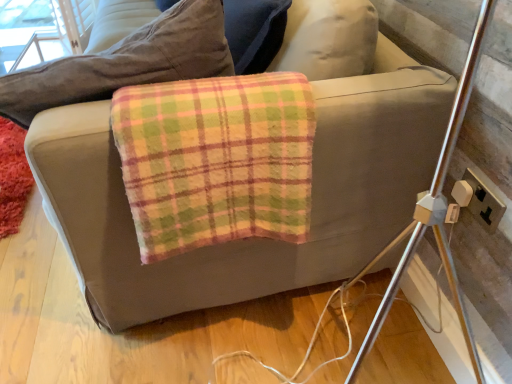
What is the approximate height of gold plastic electrical outlet at right?

It is 9.48 centimeters.

Describe the element at coordinates (13, 177) in the screenshot. I see `fluffy red mat at lower left` at that location.

What is the approximate width of plaid fleece blanket at center?

It is 10.97 inches.

Where is `gold plastic electrical outlet at right`? This screenshot has height=384, width=512. gold plastic electrical outlet at right is located at coordinates (484, 203).

Based on the photo, in terms of height, does plaid fleece blanket at center look taller or shorter compared to gold plastic electrical outlet at right?

In the image, plaid fleece blanket at center appears to be taller than gold plastic electrical outlet at right.

Considering the positions of objects plaid fleece blanket at center and gold plastic electrical outlet at right in the image provided, who is in front, plaid fleece blanket at center or gold plastic electrical outlet at right?

plaid fleece blanket at center is more forward.

Who is bigger, plaid fleece blanket at center or gold plastic electrical outlet at right?

Bigger between the two is plaid fleece blanket at center.

Which object is positioned more to the left, fluffy red mat at lower left or plaid fleece blanket at center?

Positioned to the left is fluffy red mat at lower left.

Is fluffy red mat at lower left touching plaid fleece blanket at center?

fluffy red mat at lower left and plaid fleece blanket at center are clearly separated.

Is fluffy red mat at lower left looking in the opposite direction of plaid fleece blanket at center?

No, fluffy red mat at lower left's orientation is not away from plaid fleece blanket at center.

From the image's perspective, relative to plaid fleece blanket at center, is fluffy red mat at lower left above or below?

fluffy red mat at lower left is above plaid fleece blanket at center.

Can you confirm if plaid fleece blanket at center is positioned to the right of fluffy red mat at lower left?

Correct, you'll find plaid fleece blanket at center to the right of fluffy red mat at lower left.

Considering the sizes of plaid fleece blanket at center and fluffy red mat at lower left in the image, is plaid fleece blanket at center bigger or smaller than fluffy red mat at lower left?

plaid fleece blanket at center is bigger than fluffy red mat at lower left.

Which is in front, plaid fleece blanket at center or fluffy red mat at lower left?

plaid fleece blanket at center is closer to the camera.

Between fluffy red mat at lower left and gold plastic electrical outlet at right, which one has smaller width?

gold plastic electrical outlet at right.

From the image's perspective, would you say fluffy red mat at lower left is positioned over gold plastic electrical outlet at right?

Yes.

Considering the positions of objects fluffy red mat at lower left and gold plastic electrical outlet at right in the image provided, who is more to the right, fluffy red mat at lower left or gold plastic electrical outlet at right?

Positioned to the right is gold plastic electrical outlet at right.

From the picture: How much distance is there between fluffy red mat at lower left and gold plastic electrical outlet at right?

fluffy red mat at lower left and gold plastic electrical outlet at right are 5.36 feet apart.

Is gold plastic electrical outlet at right to the left or to the right of plaid fleece blanket at center in the image?

Based on their positions, gold plastic electrical outlet at right is located to the right of plaid fleece blanket at center.

Considering the relative sizes of gold plastic electrical outlet at right and plaid fleece blanket at center in the image provided, is gold plastic electrical outlet at right thinner than plaid fleece blanket at center?

Correct, the width of gold plastic electrical outlet at right is less than that of plaid fleece blanket at center.

Are gold plastic electrical outlet at right and plaid fleece blanket at center located far from each other?

No.

Considering the relative sizes of gold plastic electrical outlet at right and plaid fleece blanket at center in the image provided, is gold plastic electrical outlet at right taller than plaid fleece blanket at center?

In fact, gold plastic electrical outlet at right may be shorter than plaid fleece blanket at center.

Is gold plastic electrical outlet at right completely or partially outside of fluffy red mat at lower left?

Absolutely, gold plastic electrical outlet at right is external to fluffy red mat at lower left.

Can you confirm if gold plastic electrical outlet at right is positioned to the left of fluffy red mat at lower left?

In fact, gold plastic electrical outlet at right is to the right of fluffy red mat at lower left.

Is point (472, 206) closer to camera compared to point (20, 221)?

That is True.

Identify the location of electric outlet behind the plaid fleece blanket at center. (484, 203).

Where is `material above the fluffy red mat at lower left (from a real-world perspective)`? This screenshot has height=384, width=512. material above the fluffy red mat at lower left (from a real-world perspective) is located at coordinates (216, 160).

When comparing their distances from fluffy red mat at lower left, does plaid fleece blanket at center or gold plastic electrical outlet at right seem further?

The object further to fluffy red mat at lower left is gold plastic electrical outlet at right.

From the image, which object appears to be nearer to gold plastic electrical outlet at right, plaid fleece blanket at center or fluffy red mat at lower left?

plaid fleece blanket at center is positioned closer to the anchor gold plastic electrical outlet at right.

Which object lies nearer to the anchor point fluffy red mat at lower left, gold plastic electrical outlet at right or plaid fleece blanket at center?

Based on the image, plaid fleece blanket at center appears to be nearer to fluffy red mat at lower left.

Based on the photo, when comparing their distances from gold plastic electrical outlet at right, does fluffy red mat at lower left or plaid fleece blanket at center seem further?

fluffy red mat at lower left is further to gold plastic electrical outlet at right.

From the image, which object appears to be farther from plaid fleece blanket at center, fluffy red mat at lower left or gold plastic electrical outlet at right?

fluffy red mat at lower left is further to plaid fleece blanket at center.

When comparing their distances from plaid fleece blanket at center, does gold plastic electrical outlet at right or fluffy red mat at lower left seem further?

fluffy red mat at lower left is further to plaid fleece blanket at center.

I want to click on material situated between fluffy red mat at lower left and gold plastic electrical outlet at right from left to right, so click(216, 160).